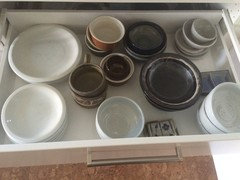
Image resolution: width=240 pixels, height=180 pixels. I want to click on blue dish, so click(217, 79).